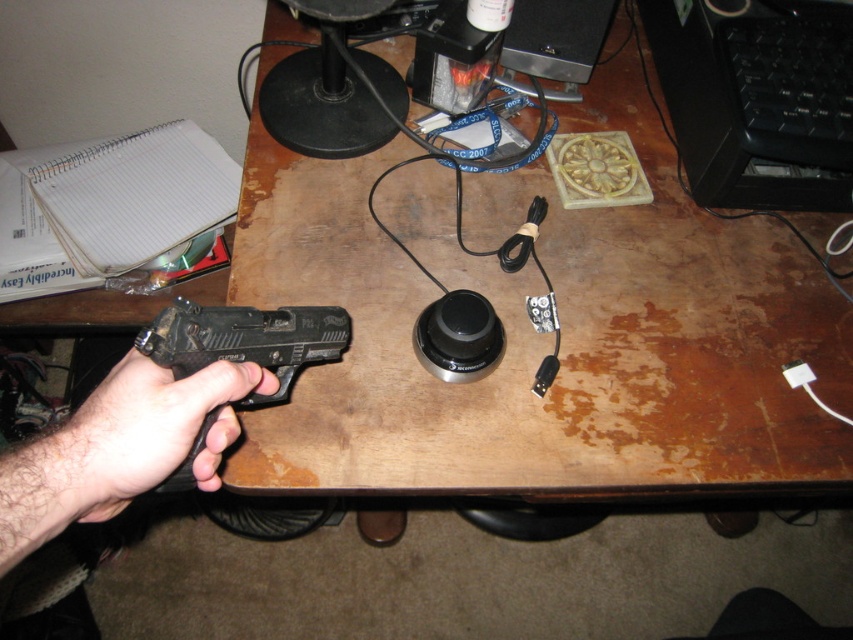
Find the location of `brown wooden desk at center`. brown wooden desk at center is located at coordinates (543, 333).

At what (x,y) coordinates should I click in order to perform the action: click on brown wooden desk at center. Please return your answer as a coordinate pair (x, y). Image resolution: width=853 pixels, height=640 pixels. Looking at the image, I should click on (543, 333).

Where is `brown wooden desk at center`? The width and height of the screenshot is (853, 640). brown wooden desk at center is located at coordinates (543, 333).

Between black matte gun at lower left and black matte handgun at left, which one appears on the right side from the viewer's perspective?

black matte handgun at left is more to the right.

Can you confirm if black matte gun at lower left is wider than black matte handgun at left?

No.

Is point (241, 372) positioned behind point (273, 349)?

No, (241, 372) is in front of (273, 349).

The width and height of the screenshot is (853, 640). In order to click on black matte gun at lower left in this screenshot , I will do `click(155, 426)`.

Is point (315, 372) in front of point (157, 397)?

No, (315, 372) is further to viewer.

Measure the distance between brown wooden desk at center and camera.

brown wooden desk at center is 24.30 inches from camera.

Between point (769, 298) and point (213, 365), which one is positioned behind?

The point (769, 298) is more distant.

Locate an element on the screen. The height and width of the screenshot is (640, 853). brown wooden desk at center is located at coordinates (543, 333).